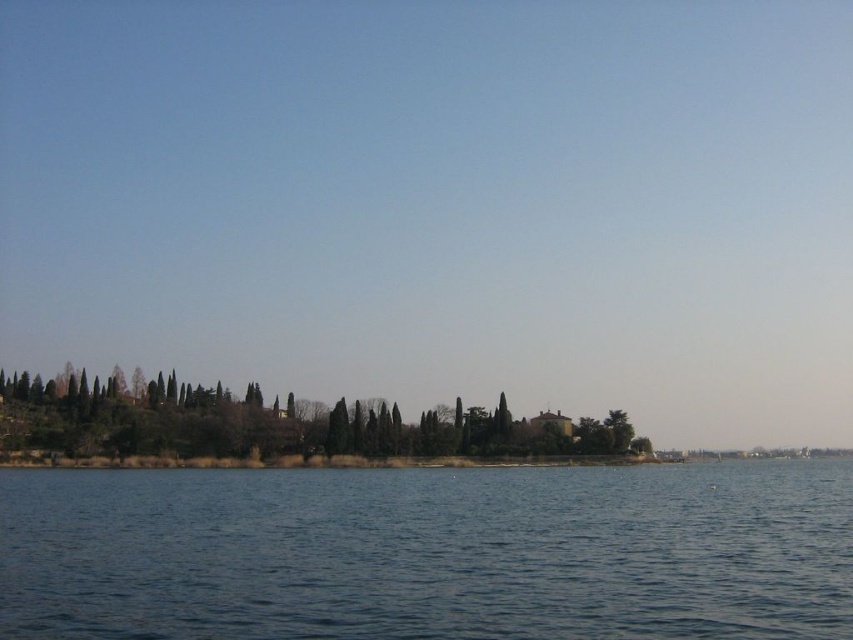
You are standing at the lakeside and want to take a photo of both the blue water at center and the green textured trees at center. Which object should you focus on first if you want to capture both in a single frame without moving the camera?

You should focus on the blue water at center first because it is taller than the green textured trees at center, so adjusting the focus to the water ensures both are in the frame.

In the scene shown: You are standing at the lakeside and notice the blue water at center and the green textured trees at center. Which one is positioned to the right side from your viewpoint?

The blue water at center is positioned to the right of the green textured trees at center.

You are an architect designing a new lakeside resort. You need to ensure that the blue water at center and the green textured trees at center are both visible from the main lounge. Given their sizes, which one will occupy more visual space in the lounge window?

The blue water at center is bigger than the green textured trees at center, so it will occupy more visual space in the lounge window.